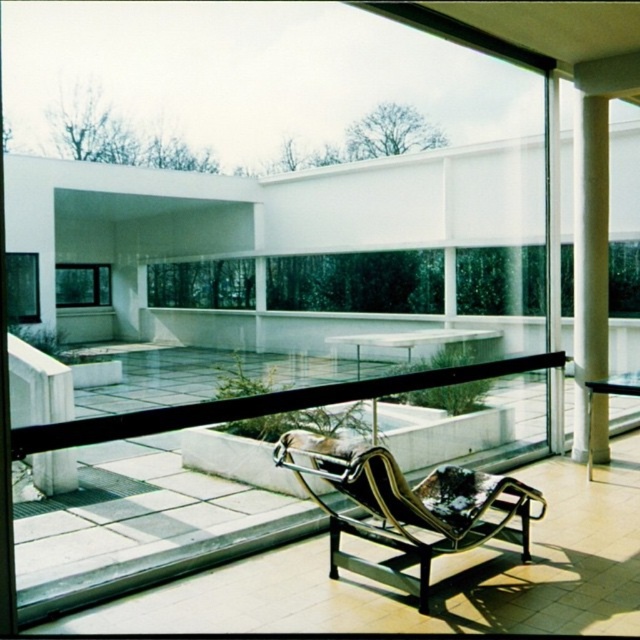
You are standing inside the modern architectural interior space and want to exit through one of the transparent glass windows. Which window, the transparent glass window at center or the transparent glass window at lower left, is located more to the right side?

The transparent glass window at center is positioned on the right side of the transparent glass window at lower left, so the transparent glass window at center is more to the right side.

You are standing inside the modern architectural interior space. There is a point marked at coordinates (356, 282). What object is located at this point?

The point at coordinates (356, 282) indicates the transparent glass window at center.